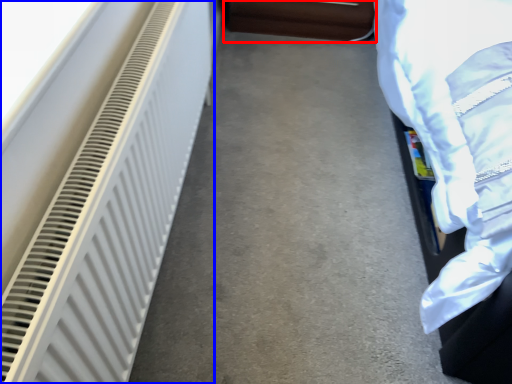
Question: Which object appears farthest to the camera in this image, furniture (highlighted by a red box) or radiator (highlighted by a blue box)?

Choices:
 (A) furniture
 (B) radiator

Answer: (A)